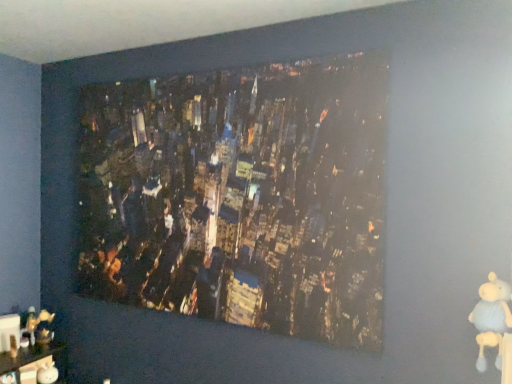
Question: Is wooden figurine at lower left spatially inside matte cityscape print at center, or outside of it?

Choices:
 (A) inside
 (B) outside

Answer: (B)

Question: Looking at the image, does wooden figurine at lower left seem bigger or smaller compared to matte cityscape print at center?

Choices:
 (A) small
 (B) big

Answer: (A)

Question: Estimate the real-world distances between objects in this image. Which object is closer to the wooden figurine at lower left?

Choices:
 (A) white plush bear at lower right
 (B) matte cityscape print at center

Answer: (B)

Question: Estimate the real-world distances between objects in this image. Which object is farther from the wooden figurine at lower left?

Choices:
 (A) white plush bear at lower right
 (B) matte cityscape print at center

Answer: (A)